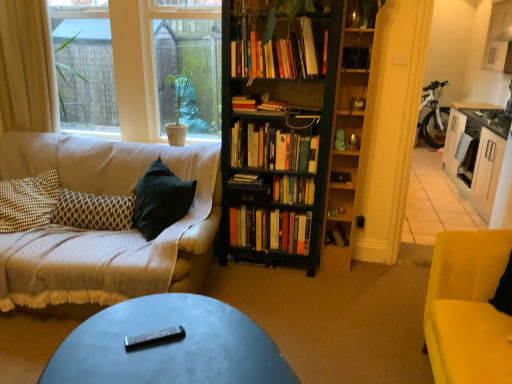
Question: Which direction should I rotate to look at hardcover book at center, which is the sixth book in bottom-to-top order, — up or down?

Choices:
 (A) down
 (B) up

Answer: (B)

Question: From a real-world perspective, is hardcover book at center, which is the 4th book from bottom to top, physically below clear glass window screen at upper left?

Choices:
 (A) no
 (B) yes

Answer: (B)

Question: Is hardcover book at center, the 5th book when ordered from top to bottom, bigger than clear glass window screen at upper left?

Choices:
 (A) no
 (B) yes

Answer: (A)

Question: From a real-world perspective, is hardcover book at center, which is the 4th book from bottom to top, physically above clear glass window screen at upper left?

Choices:
 (A) no
 (B) yes

Answer: (A)

Question: Is hardcover book at center, which is the 4th book from bottom to top, turned away from clear glass window screen at upper left?

Choices:
 (A) yes
 (B) no

Answer: (B)

Question: Can you confirm if hardcover book at center, the 5th book when ordered from top to bottom, is taller than clear glass window screen at upper left?

Choices:
 (A) yes
 (B) no

Answer: (B)

Question: From the image's perspective, would you say hardcover book at center, which is the 4th book from bottom to top, is shown under clear glass window screen at upper left?

Choices:
 (A) yes
 (B) no

Answer: (A)

Question: From a real-world perspective, is wooden shelf at right on hardcover book at center, the 5th book when ordered from top to bottom?

Choices:
 (A) yes
 (B) no

Answer: (A)

Question: Considering the relative sizes of wooden shelf at right and hardcover book at center, the 5th book when ordered from top to bottom, in the image provided, is wooden shelf at right thinner than hardcover book at center, the 5th book when ordered from top to bottom,?

Choices:
 (A) no
 (B) yes

Answer: (A)

Question: Can you confirm if wooden shelf at right is positioned to the right of hardcover book at center, the 5th book when ordered from top to bottom?

Choices:
 (A) yes
 (B) no

Answer: (A)

Question: Does wooden shelf at right turn towards hardcover book at center, the 5th book when ordered from top to bottom?

Choices:
 (A) no
 (B) yes

Answer: (A)

Question: From a real-world perspective, is wooden shelf at right physically below hardcover book at center, the 5th book when ordered from top to bottom?

Choices:
 (A) no
 (B) yes

Answer: (A)

Question: Can you confirm if wooden shelf at right is taller than hardcover book at center, the 5th book when ordered from top to bottom?

Choices:
 (A) yes
 (B) no

Answer: (A)

Question: Considering the relative sizes of hardcover books at center, positioned as the 5th book in bottom-to-top order, and hardcover books at center, which appears as the 3th book when ordered from the bottom, in the image provided, is hardcover books at center, positioned as the 5th book in bottom-to-top order, shorter than hardcover books at center, which appears as the 3th book when ordered from the bottom,?

Choices:
 (A) yes
 (B) no

Answer: (B)